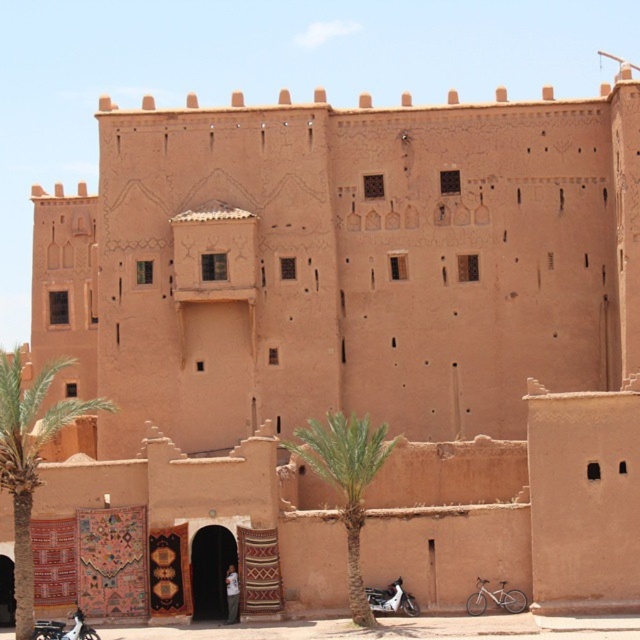
Question: Is green leafy palm tree at left above white matte motorcycle at lower center?

Choices:
 (A) no
 (B) yes

Answer: (B)

Question: Which point appears closest to the camera in this image?

Choices:
 (A) (413, 602)
 (B) (368, 627)

Answer: (B)

Question: Which object appears closest to the camera in this image?

Choices:
 (A) white matte motorcycle at lower right
 (B) white fabric motorcyclist at center

Answer: (A)

Question: Can you confirm if metallic silver motorcycle at lower left is wider than white fabric motorcyclist at center?

Choices:
 (A) yes
 (B) no

Answer: (B)

Question: Does green leafy palm tree at center come in front of white matte motorcycle at lower right?

Choices:
 (A) yes
 (B) no

Answer: (A)

Question: Among these objects, which one is nearest to the camera?

Choices:
 (A) metallic silver motorcycle at lower left
 (B) white matte motorcycle at lower right
 (C) green leafy palm tree at left

Answer: (C)